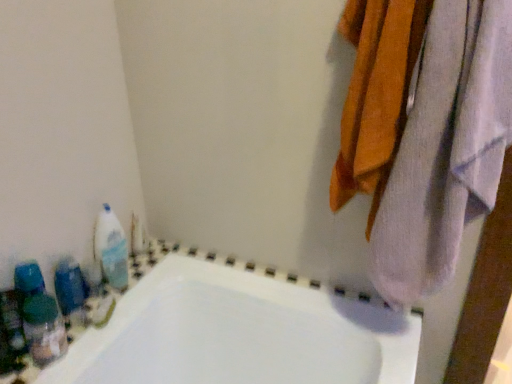
Question: Considering the relative sizes of white glossy bottle at left, the 2th cleaning product positioned from the bottom, and blue plastic bottles at left in the image provided, is white glossy bottle at left, the 2th cleaning product positioned from the bottom, shorter than blue plastic bottles at left?

Choices:
 (A) yes
 (B) no

Answer: (B)

Question: Is white glossy bottle at left, the 2th cleaning product positioned from the bottom, facing towards blue plastic bottles at left?

Choices:
 (A) no
 (B) yes

Answer: (A)

Question: Does white glossy bottle at left, arranged as the second cleaning product when viewed from the front, appear on the right side of blue plastic bottles at left?

Choices:
 (A) yes
 (B) no

Answer: (A)

Question: Are white glossy bottle at left, arranged as the second cleaning product when viewed from the front, and blue plastic bottles at left far apart?

Choices:
 (A) yes
 (B) no

Answer: (B)

Question: Can you confirm if white glossy bottle at left, the 2th cleaning product positioned from the bottom, is bigger than blue plastic bottles at left?

Choices:
 (A) no
 (B) yes

Answer: (B)

Question: From a real-world perspective, relative to white glossy bottle at left, placed as the first cleaning product when sorted from top to bottom, is blue plastic bottles at left vertically above or below?

Choices:
 (A) above
 (B) below

Answer: (B)

Question: Looking at their shapes, would you say blue plastic bottles at left is wider or thinner than white glossy bottle at left, arranged as the second cleaning product when viewed from the front?

Choices:
 (A) wide
 (B) thin

Answer: (B)

Question: Considering the positions of blue plastic bottles at left and white glossy bottle at left, marked as the 1th cleaning product in a back-to-front arrangement, in the image, is blue plastic bottles at left bigger or smaller than white glossy bottle at left, marked as the 1th cleaning product in a back-to-front arrangement,?

Choices:
 (A) big
 (B) small

Answer: (B)

Question: Considering the relative positions of blue plastic bottles at left and white glossy bottle at left, the 2th cleaning product positioned from the bottom, in the image provided, is blue plastic bottles at left to the left or to the right of white glossy bottle at left, the 2th cleaning product positioned from the bottom,?

Choices:
 (A) left
 (B) right

Answer: (A)

Question: From a real-world perspective, is translucent plastic bottles at left, the second cleaning product in the top-to-bottom sequence, physically located above or below blue plastic bottles at left?

Choices:
 (A) below
 (B) above

Answer: (B)

Question: In terms of height, does translucent plastic bottles at left, acting as the second cleaning product starting from the back, look taller or shorter compared to blue plastic bottles at left?

Choices:
 (A) tall
 (B) short

Answer: (A)

Question: Is point (55, 332) positioned closer to the camera than point (56, 291)?

Choices:
 (A) closer
 (B) farther

Answer: (A)

Question: Is translucent plastic bottles at left, acting as the second cleaning product starting from the back, bigger or smaller than blue plastic bottles at left?

Choices:
 (A) small
 (B) big

Answer: (B)

Question: Considering the positions of point (452, 195) and point (115, 221), is point (452, 195) closer or farther from the camera than point (115, 221)?

Choices:
 (A) farther
 (B) closer

Answer: (B)

Question: From a real-world perspective, is white soft towel at upper right positioned above or below white glossy bottle at left, placed as the first cleaning product when sorted from top to bottom?

Choices:
 (A) above
 (B) below

Answer: (A)